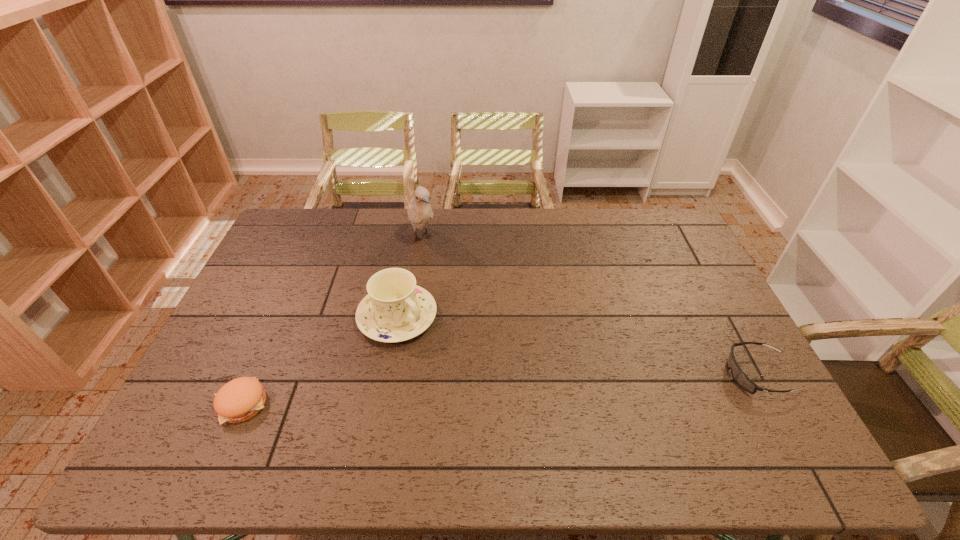
Identify the location of object that is at the right edge. The width and height of the screenshot is (960, 540). (741, 379).

Where is `object that is positioned at the near left corner`? The image size is (960, 540). object that is positioned at the near left corner is located at coordinates (240, 399).

I want to click on object that is at the near right corner, so point(741,379).

The image size is (960, 540). I want to click on vacant area at the far edge, so click(353, 209).

You are a GUI agent. You are given a task and a screenshot of the screen. Output one action in this format:
    pyautogui.click(x=<x>, y=<y>)
    Task: Click on the vacant space at the near edge of the desktop
    This screenshot has width=960, height=540.
    Given the screenshot: What is the action you would take?
    pyautogui.click(x=318, y=399)

This screenshot has width=960, height=540. In order to click on free space at the left edge of the desktop in this screenshot , I will do `click(310, 260)`.

The height and width of the screenshot is (540, 960). Find the location of `vacant space at the right edge of the desktop`. vacant space at the right edge of the desktop is located at coordinates (727, 320).

You are a GUI agent. You are given a task and a screenshot of the screen. Output one action in this format:
    pyautogui.click(x=<x>, y=<y>)
    Task: Click on the vacant space at the far left corner of the desktop
    
    Given the screenshot: What is the action you would take?
    pyautogui.click(x=326, y=212)

I want to click on vacant area at the near right corner, so click(x=747, y=419).

Identify the location of free area in between the tallest object and the goggles. (589, 306).